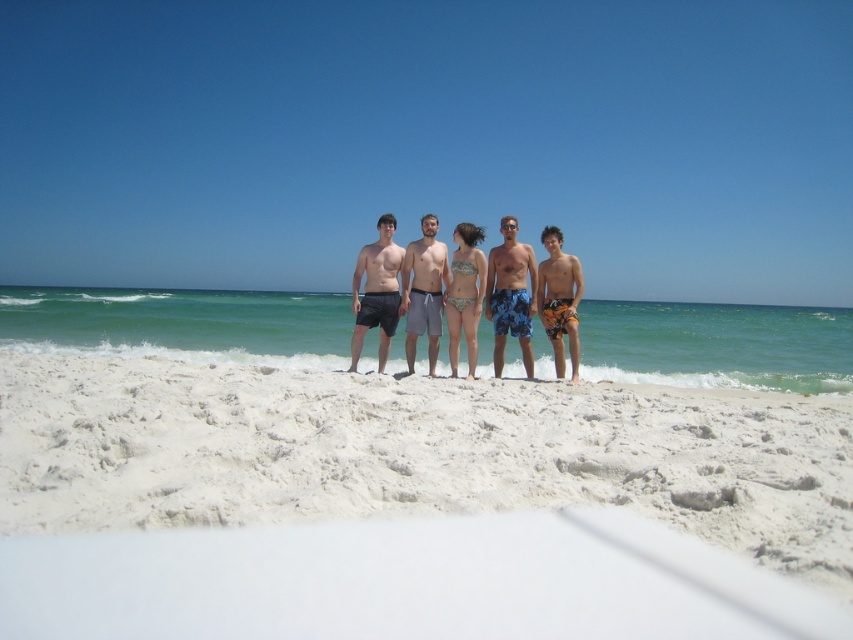
You are a photographer trying to capture a photo of the white sandy beach at center and the gray fabric shorts at center. Based on their heights, which object should you focus on first to ensure both are in frame?

The white sandy beach at center has a lesser height compared to gray fabric shorts at center, so you should focus on the gray fabric shorts at center first to ensure both are in frame.

Looking at this image, based on the scene description and the coordinates provided, can you identify the object located at point (509, 294)?

The point (509, 294) indicates blue printed shorts at center.

You are standing on the beach and want to reach the point at coordinates point (509, 250). If you can walk 5 feet per second, how many seconds will it take you to reach that point?

The distance between you and the point (509, 250) is 37.11 feet. At a walking speed of 5 feet per second, it would take approximately 7.42 seconds to reach the point.